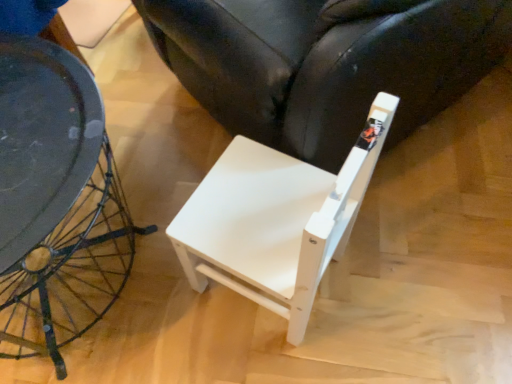
The height and width of the screenshot is (384, 512). I want to click on white matte chair at center, the 1th chair from the bottom, so click(276, 219).

What do you see at coordinates (276, 219) in the screenshot?
I see `white matte chair at center, the second chair viewed from the top` at bounding box center [276, 219].

What do you see at coordinates (326, 63) in the screenshot? This screenshot has width=512, height=384. I see `white matte chair at lower right, arranged as the 2th chair when ordered from the bottom` at bounding box center [326, 63].

The width and height of the screenshot is (512, 384). I want to click on white matte chair at lower right, the first chair when ordered from top to bottom, so click(x=326, y=63).

I want to click on white matte chair at center, the 1th chair from the bottom, so click(276, 219).

Considering the positions of objects white matte chair at center, the 1th chair from the bottom, and white matte chair at lower right, arranged as the 2th chair when ordered from the bottom, in the image provided, who is more to the right, white matte chair at center, the 1th chair from the bottom, or white matte chair at lower right, arranged as the 2th chair when ordered from the bottom,?

From the viewer's perspective, white matte chair at lower right, arranged as the 2th chair when ordered from the bottom, appears more on the right side.

Is white matte chair at center, the 1th chair from the bottom, further to camera compared to white matte chair at lower right, arranged as the 2th chair when ordered from the bottom?

No, the depth of white matte chair at center, the 1th chair from the bottom, is less than that of white matte chair at lower right, arranged as the 2th chair when ordered from the bottom.

Considering the positions of point (238, 273) and point (409, 39), is point (238, 273) closer or farther from the camera than point (409, 39)?

Clearly, point (238, 273) is more distant from the camera than point (409, 39).

From the image's perspective, is white matte chair at center, the second chair viewed from the top, over white matte chair at lower right, arranged as the 2th chair when ordered from the bottom?

Incorrect, from the image's perspective, white matte chair at center, the second chair viewed from the top, is lower than white matte chair at lower right, arranged as the 2th chair when ordered from the bottom.

From a real-world perspective, is white matte chair at center, the second chair viewed from the top, above or below white matte chair at lower right, the first chair when ordered from top to bottom?

Clearly, from a real-world perspective, white matte chair at center, the second chair viewed from the top, is below white matte chair at lower right, the first chair when ordered from top to bottom.

Considering the sizes of white matte chair at center, the 1th chair from the bottom, and white matte chair at lower right, the first chair when ordered from top to bottom, in the image, is white matte chair at center, the 1th chair from the bottom, wider or thinner than white matte chair at lower right, the first chair when ordered from top to bottom,?

white matte chair at center, the 1th chair from the bottom, is thinner than white matte chair at lower right, the first chair when ordered from top to bottom.

Which of these two, white matte chair at center, the second chair viewed from the top, or white matte chair at lower right, the first chair when ordered from top to bottom, stands taller?

Standing taller between the two is white matte chair at lower right, the first chair when ordered from top to bottom.

Is white matte chair at center, the 1th chair from the bottom, bigger or smaller than white matte chair at lower right, arranged as the 2th chair when ordered from the bottom?

Considering their sizes, white matte chair at center, the 1th chair from the bottom, takes up less space than white matte chair at lower right, arranged as the 2th chair when ordered from the bottom.

Is white matte chair at lower right, the first chair when ordered from top to bottom, completely or partially inside white matte chair at center, the 1th chair from the bottom?

Actually, white matte chair at lower right, the first chair when ordered from top to bottom, is outside white matte chair at center, the 1th chair from the bottom.

Are white matte chair at center, the second chair viewed from the top, and white matte chair at lower right, arranged as the 2th chair when ordered from the bottom, located far from each other?

No, white matte chair at center, the second chair viewed from the top, is in close proximity to white matte chair at lower right, arranged as the 2th chair when ordered from the bottom.

Is white matte chair at center, the 1th chair from the bottom, facing away from white matte chair at lower right, the first chair when ordered from top to bottom?

No, white matte chair at center, the 1th chair from the bottom,'s orientation is not away from white matte chair at lower right, the first chair when ordered from top to bottom.

How many degrees apart are the facing directions of white matte chair at center, the second chair viewed from the top, and white matte chair at lower right, arranged as the 2th chair when ordered from the bottom?

They differ by 70.9 degrees in their facing directions.

Could you measure the distance between white matte chair at center, the second chair viewed from the top, and white matte chair at lower right, arranged as the 2th chair when ordered from the bottom?

The distance of white matte chair at center, the second chair viewed from the top, from white matte chair at lower right, arranged as the 2th chair when ordered from the bottom, is 9.42 inches.

The width and height of the screenshot is (512, 384). I want to click on chair that appears on the right of white matte chair at center, the 1th chair from the bottom, so click(x=326, y=63).

Does white matte chair at lower right, the first chair when ordered from top to bottom, appear on the left side of white matte chair at center, the 1th chair from the bottom?

No, white matte chair at lower right, the first chair when ordered from top to bottom, is not to the left of white matte chair at center, the 1th chair from the bottom.

Is white matte chair at lower right, arranged as the 2th chair when ordered from the bottom, further to the viewer compared to white matte chair at center, the 1th chair from the bottom?

Yes, it is.

Which is behind, point (266, 24) or point (220, 211)?

The point (266, 24) is farther from the camera.

Based on the photo, from the image's perspective, is white matte chair at lower right, arranged as the 2th chair when ordered from the bottom, located above or below white matte chair at center, the second chair viewed from the top?

Based on their image positions, white matte chair at lower right, arranged as the 2th chair when ordered from the bottom, is located above white matte chair at center, the second chair viewed from the top.

From a real-world perspective, does white matte chair at lower right, the first chair when ordered from top to bottom, sit lower than white matte chair at center, the second chair viewed from the top?

Actually, white matte chair at lower right, the first chair when ordered from top to bottom, is physically above white matte chair at center, the second chair viewed from the top, in the real world.

Which object is wider, white matte chair at lower right, the first chair when ordered from top to bottom, or white matte chair at center, the second chair viewed from the top?

Wider between the two is white matte chair at lower right, the first chair when ordered from top to bottom.

Considering the relative sizes of white matte chair at lower right, the first chair when ordered from top to bottom, and white matte chair at center, the 1th chair from the bottom, in the image provided, is white matte chair at lower right, the first chair when ordered from top to bottom, shorter than white matte chair at center, the 1th chair from the bottom,?

In fact, white matte chair at lower right, the first chair when ordered from top to bottom, may be taller than white matte chair at center, the 1th chair from the bottom.

Which of these two, white matte chair at lower right, arranged as the 2th chair when ordered from the bottom, or white matte chair at center, the second chair viewed from the top, is bigger?

With larger size is white matte chair at lower right, arranged as the 2th chair when ordered from the bottom.

Is white matte chair at lower right, the first chair when ordered from top to bottom, completely or partially outside of white matte chair at center, the second chair viewed from the top?

white matte chair at lower right, the first chair when ordered from top to bottom, lies outside white matte chair at center, the second chair viewed from the top,'s area.

Is white matte chair at lower right, arranged as the 2th chair when ordered from the bottom, directly adjacent to white matte chair at center, the second chair viewed from the top?

No, white matte chair at lower right, arranged as the 2th chair when ordered from the bottom, is not making contact with white matte chair at center, the second chair viewed from the top.

Is white matte chair at lower right, the first chair when ordered from top to bottom, oriented towards white matte chair at center, the second chair viewed from the top?

Yes, white matte chair at lower right, the first chair when ordered from top to bottom, is facing white matte chair at center, the second chair viewed from the top.

The width and height of the screenshot is (512, 384). What are the coordinates of `chair on the left side of white matte chair at lower right, arranged as the 2th chair when ordered from the bottom` in the screenshot? It's located at (276, 219).

I want to click on chair that is above the white matte chair at center, the 1th chair from the bottom (from a real-world perspective), so click(x=326, y=63).

Identify the location of chair in front of the white matte chair at lower right, the first chair when ordered from top to bottom. The height and width of the screenshot is (384, 512). (276, 219).